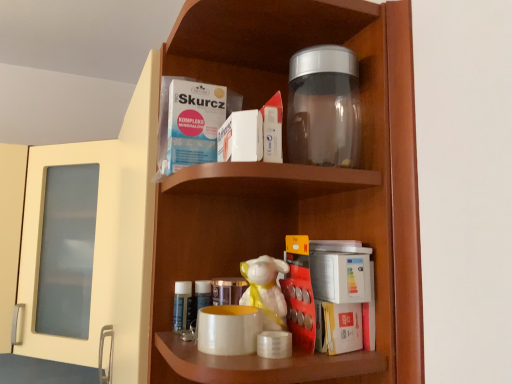
Question: From a real-world perspective, is matte white mug at center physically located above or below transparent plastic jar at upper center?

Choices:
 (A) below
 (B) above

Answer: (A)

Question: Is matte white mug at center taller or shorter than transparent plastic jar at upper center?

Choices:
 (A) short
 (B) tall

Answer: (A)

Question: Which object is the farthest from the white glossy figurine at center?

Choices:
 (A) transparent glass jar at upper center
 (B) transparent plastic jar at upper center
 (C) matte white mug at center

Answer: (B)

Question: Estimate the real-world distances between objects in this image. Which object is farther from the matte white mug at center?

Choices:
 (A) transparent glass jar at upper center
 (B) white glossy figurine at center
 (C) transparent plastic jar at upper center

Answer: (C)